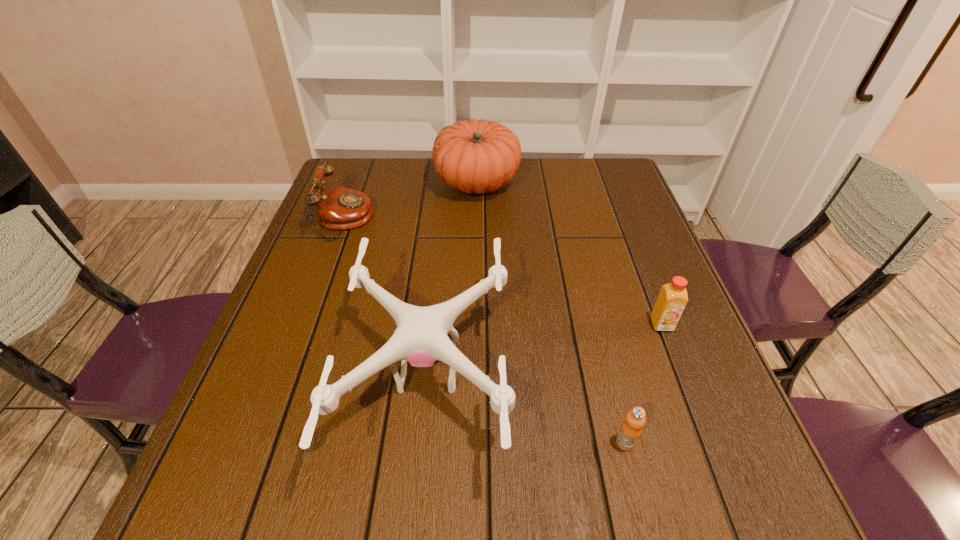
Select which object appears as the closest to the rightmost object. Please provide its 2D coordinates. Your answer should be formatted as a tuple, i.e. [(x, y)], where the tuple contains the x and y coordinates of a point satisfying the conditions above.

[(630, 431)]

You are a GUI agent. You are given a task and a screenshot of the screen. Output one action in this format:
    pyautogui.click(x=<x>, y=<y>)
    Task: Click on the object that ranks as the closest to the nearer orange juice
    The height and width of the screenshot is (540, 960).
    Given the screenshot: What is the action you would take?
    pyautogui.click(x=421, y=339)

Identify the location of free location that satisfies the following two spatial constraints: 1. on the front and back of the farther orange juice; 2. on the top of the drone. (681, 373).

Locate an element on the screen. The width and height of the screenshot is (960, 540). vacant region that satisfies the following two spatial constraints: 1. on the front and back of the right orange juice; 2. on the top of the drone is located at coordinates (681, 373).

The height and width of the screenshot is (540, 960). In order to click on vacant area in the image that satisfies the following two spatial constraints: 1. on the front side of the pumpkin; 2. on the dial of the leftmost object in this screenshot , I will do `click(476, 220)`.